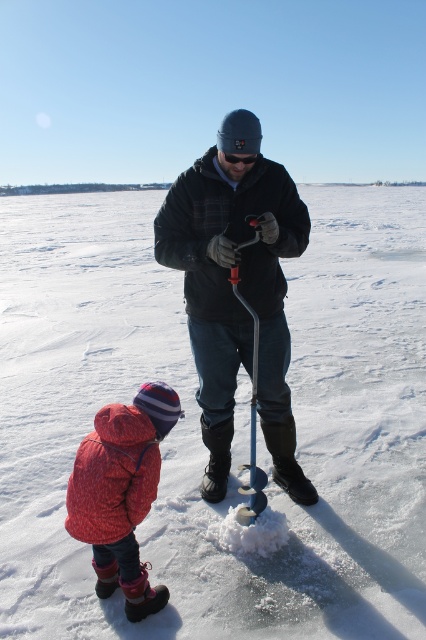
You are trying to find the fluffy pink coat at lower left in the winter scene. According to the image, where is it positioned relative to the metallic blue ski pole at center?

The fluffy pink coat at lower left is located below the metallic blue ski pole at center.

You are an ice fisherman who just arrived at the frozen lake. You see the white powdery snow at center. Where would you place your ice fishing gear?

You should place your ice fishing gear away from the white powdery snow at center because the snow indicates fresh snowfall, which might cover your gear or make it harder to locate. Alternatively, you could place it near the edge of the snow area for easy access while avoiding being buried.

You are an observer standing at the edge of the frozen lake. You notice the fluffy pink coat at lower left and the white powdery snow at center. Which object is positioned more to the right side of the image?

The white powdery snow at center is positioned to the right of the fluffy pink coat at lower left, so the white powdery snow at center is more to the right side of the image.